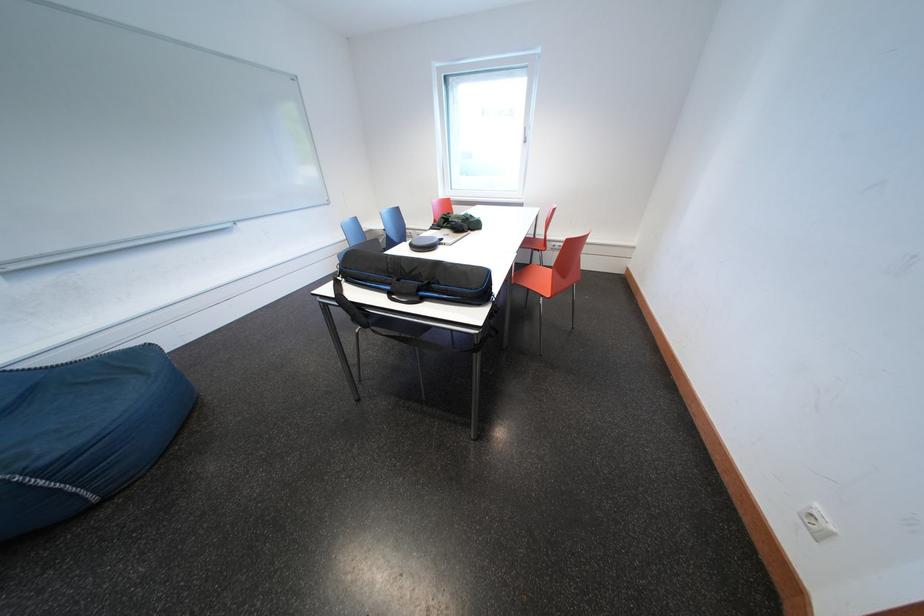
The image size is (924, 616). Describe the element at coordinates (106, 248) in the screenshot. I see `a whiteboard marker tray` at that location.